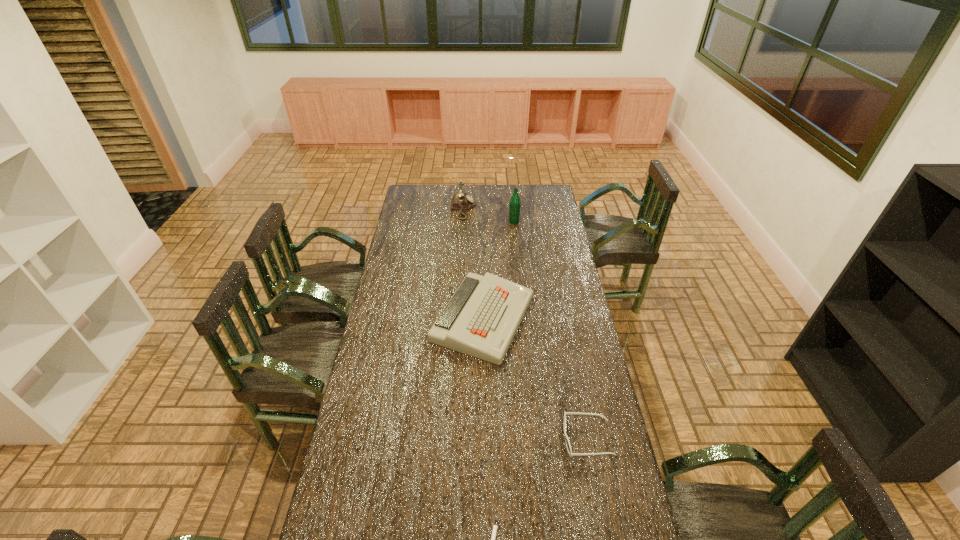
This screenshot has height=540, width=960. I want to click on free space located with the lenses of the fourth tallest object facing outward, so point(495,438).

Locate an element on the screen. vacant space located 0.160m with the lenses of the fourth tallest object facing outward is located at coordinates (516, 438).

The image size is (960, 540). Identify the location of object at the far edge. (460, 201).

Where is `object located in the right edge section of the desktop`? The height and width of the screenshot is (540, 960). object located in the right edge section of the desktop is located at coordinates (568, 446).

The image size is (960, 540). In the image, there is a desktop. What are the coordinates of `vacant space at the far edge` in the screenshot? It's located at (523, 194).

The width and height of the screenshot is (960, 540). I want to click on vacant space at the left edge of the desktop, so click(395, 237).

This screenshot has width=960, height=540. I want to click on vacant position at the right edge of the desktop, so click(570, 416).

Identify the location of vacant space at the far left corner of the desktop. Image resolution: width=960 pixels, height=540 pixels. (431, 185).

This screenshot has width=960, height=540. In order to click on unoccupied position between the tallest object and the rightmost object in this screenshot , I will do `click(551, 330)`.

The height and width of the screenshot is (540, 960). Find the location of `free space between the fourth shortest object and the second nearest object`. free space between the fourth shortest object and the second nearest object is located at coordinates (525, 323).